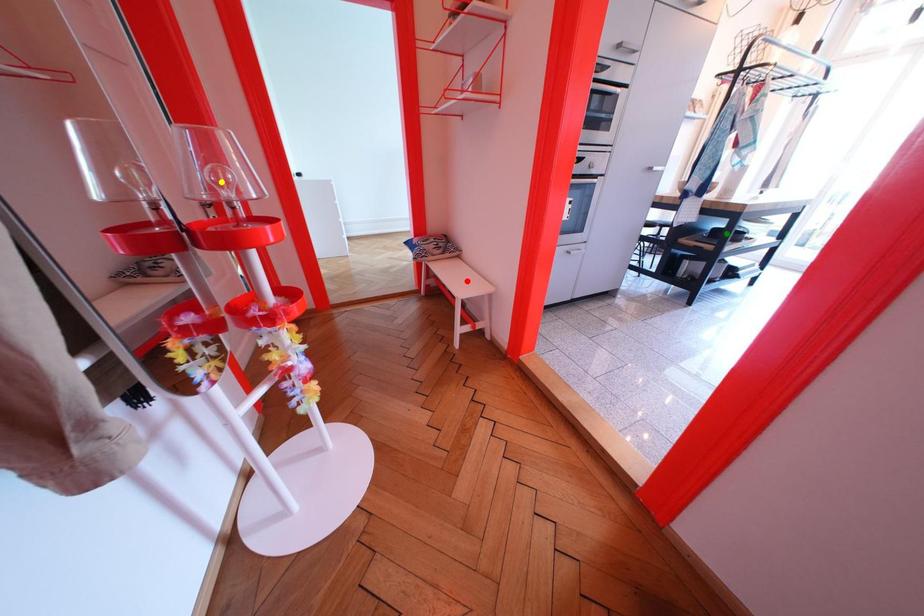
Order these from nearest to farthest:
yellow point | red point | green point

1. yellow point
2. red point
3. green point